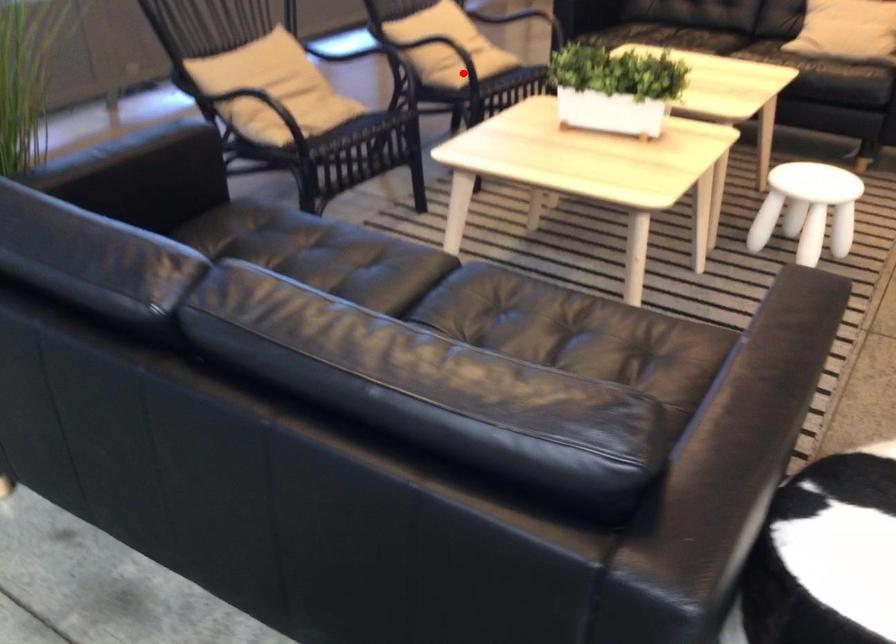
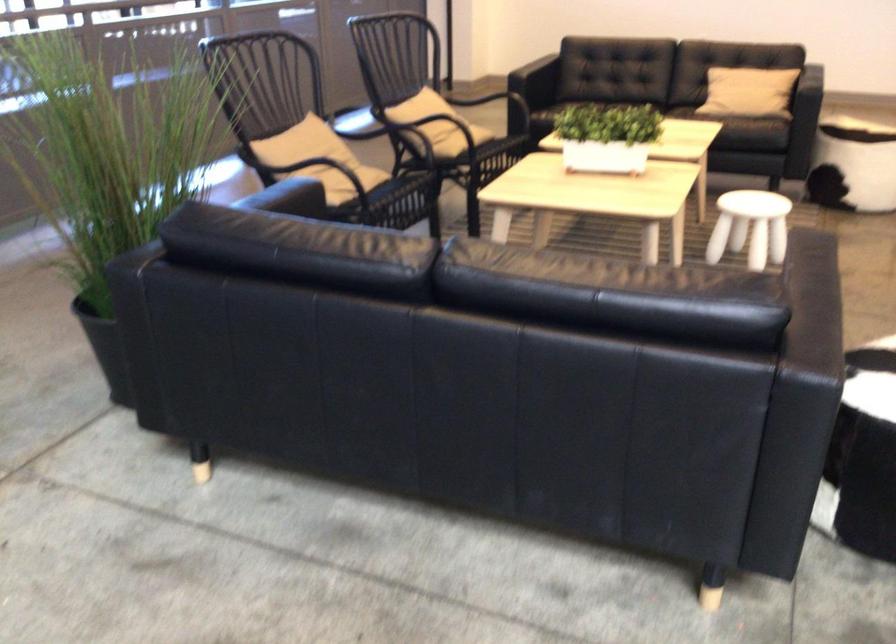
Question: I am providing you with two images of the same scene from different viewpoints. In image1, a red point is highlighted. Considering the same 3D point in image2, which of the following is correct?

Choices:
 (A) It is closer
 (B) It is farther

Answer: (B)